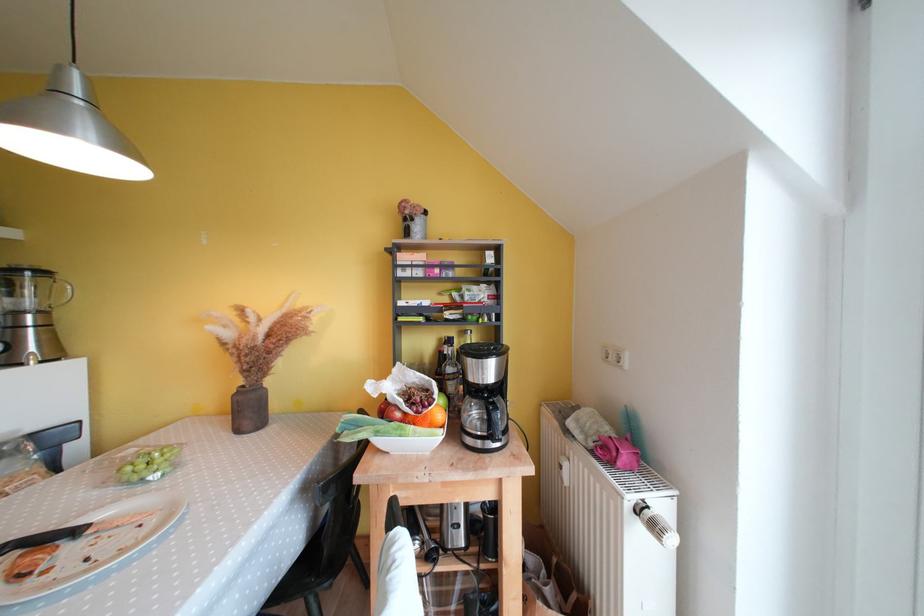
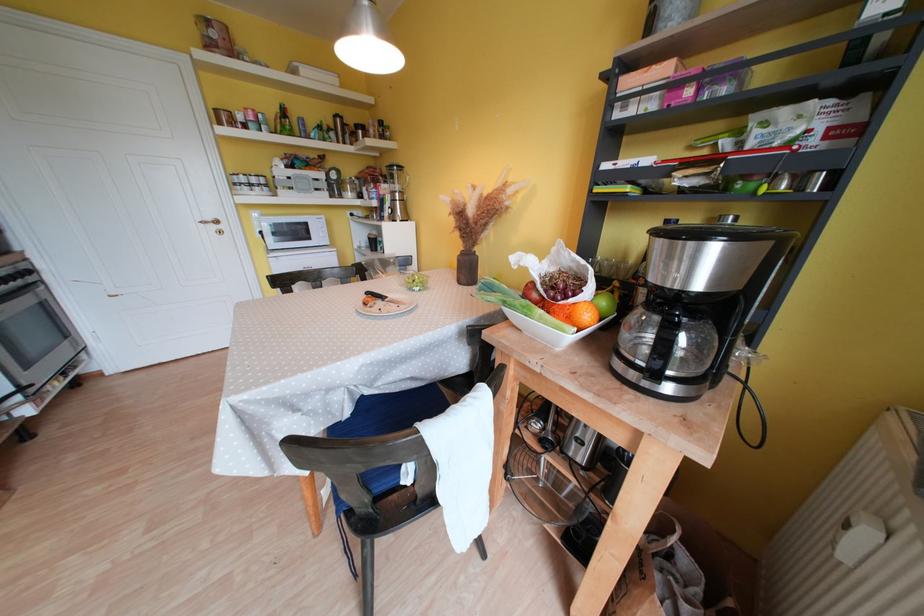
The point at [256,416] is marked in the first image. Where is the corresponding point in the second image?

(472, 275)